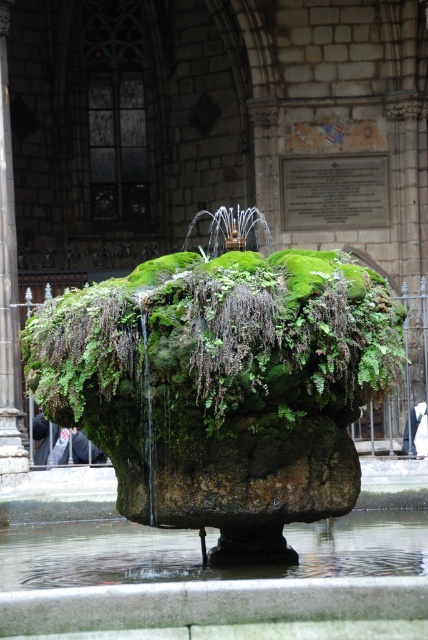
You are a landscape architect designing a maintenance plan for the courtyard. You need to determine which area requires more frequent cleaning between the green mossy rock at center and the clear water at base center. Based on their sizes, which one might need more attention?

The clear water at base center is wider than the green mossy rock at center. Since the water area is larger, it might collect more debris and require more frequent cleaning.

You are standing in the courtyard and want to know if the clear water at base center is under the dark gray stone pillar at center. Can you confirm this?

Yes, the clear water at base center is located below the dark gray stone pillar at center.